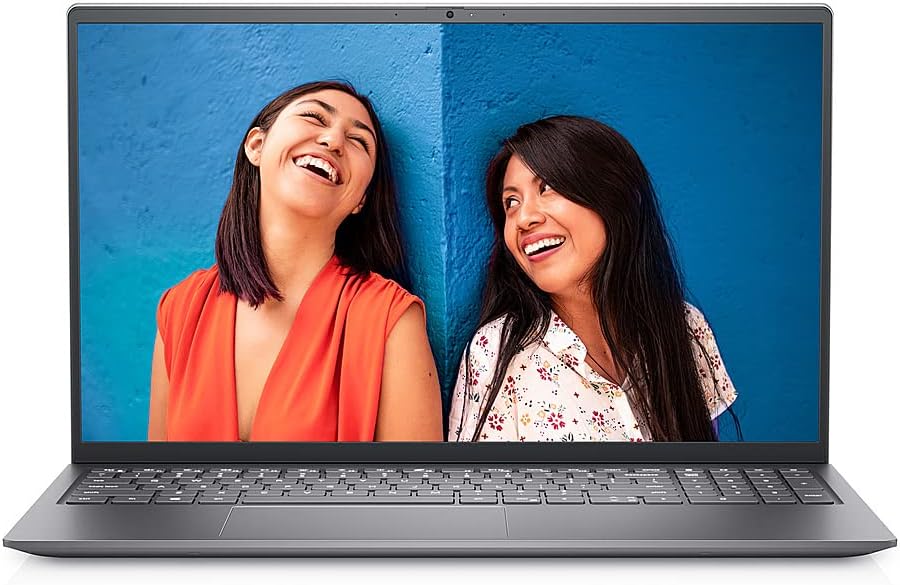
Image resolution: width=900 pixels, height=585 pixels. I want to click on the left wall, so click(126, 92).